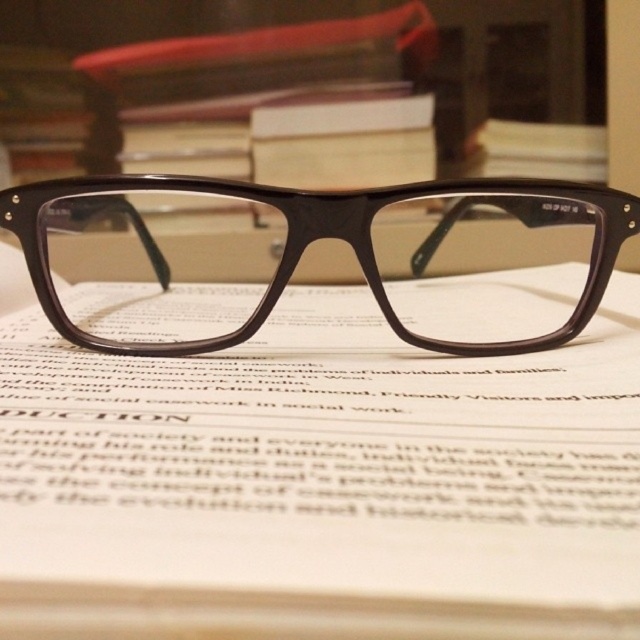
Does matte brown book at center have a smaller size compared to matte brown frame at center?

Yes.

Who is higher up, matte brown book at center or matte brown frame at center?

matte brown frame at center is above.

At what (x,y) coordinates should I click in order to perform the action: click on matte brown book at center. Please return your answer as a coordinate pair (x, y). This screenshot has width=640, height=640. Looking at the image, I should click on (321, 486).

What are the coordinates of `matte brown book at center` in the screenshot? It's located at (321, 486).